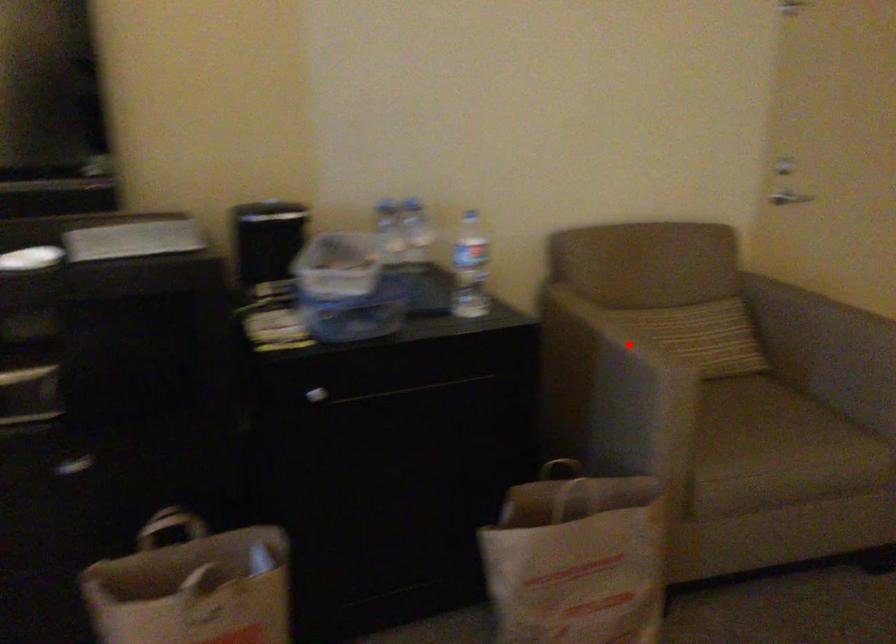
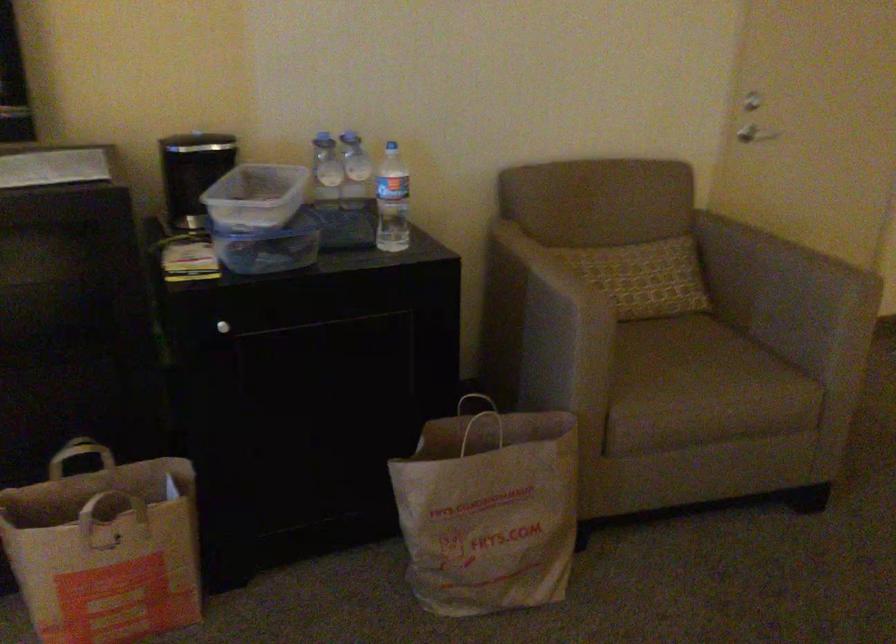
Find the pixel in the second image that matches the highlighted location in the first image.

(552, 281)